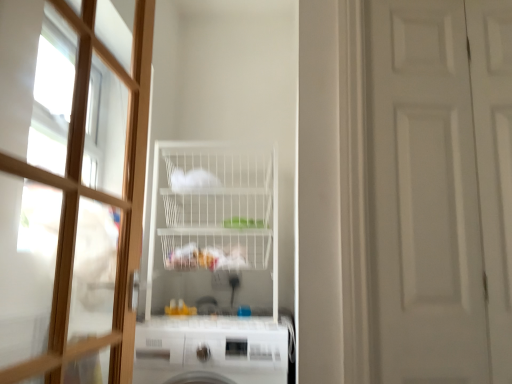
Question: Is white wire shelf at center wider or thinner than white matte door at right, placed as the second door when sorted from left to right?

Choices:
 (A) thin
 (B) wide

Answer: (B)

Question: Considering the positions of white wire shelf at center and white matte door at right, which is counted as the 1th door, starting from the right, in the image, is white wire shelf at center bigger or smaller than white matte door at right, which is counted as the 1th door, starting from the right,?

Choices:
 (A) small
 (B) big

Answer: (B)

Question: Considering the real-world distances, which object is farthest from the wooden door at left, which appears as the 2th door when viewed from the right?

Choices:
 (A) white glossy dishwasher at lower center
 (B) white wire shelf at center
 (C) white matte door at right, which is counted as the 1th door, starting from the right

Answer: (C)

Question: Based on their relative distances, which object is farther from the white matte door at right, which is counted as the 1th door, starting from the right?

Choices:
 (A) white glossy dishwasher at lower center
 (B) white wire shelf at center
 (C) wooden door at left, which appears as the 2th door when viewed from the right

Answer: (B)